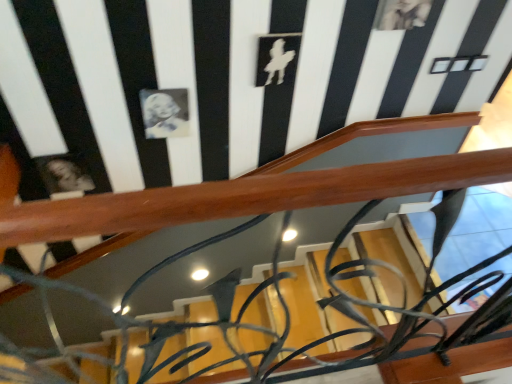
Question: Is matte black portrait at upper left, which is the second art from right to left, taller or shorter than black glossy portrait at upper center, which is the 2th art in bottom-to-top order?

Choices:
 (A) tall
 (B) short

Answer: (B)

Question: In the image, is matte black portrait at upper left, which is the first art from left to right, on the left side or the right side of black glossy portrait at upper center, which is counted as the second art, starting from the left?

Choices:
 (A) left
 (B) right

Answer: (A)

Question: From a real-world perspective, is matte black portrait at upper left, which is the first art from left to right, physically located above or below black glossy portrait at upper center, the 1th art from the top?

Choices:
 (A) below
 (B) above

Answer: (A)

Question: Relative to matte black portrait at upper left, which is the first art from left to right, is black glossy portrait at upper center, the first art in the right-to-left sequence, in front or behind?

Choices:
 (A) front
 (B) behind

Answer: (A)

Question: Is black glossy portrait at upper center, the 1th art from the top, wider or thinner than matte black portrait at upper left, which is the second art from right to left?

Choices:
 (A) wide
 (B) thin

Answer: (A)

Question: From the image's perspective, relative to matte black portrait at upper left, the second art positioned from the top, is black glossy portrait at upper center, the 1th art from the top, above or below?

Choices:
 (A) below
 (B) above

Answer: (B)

Question: Does point (178, 122) appear closer or farther from the camera than point (58, 167)?

Choices:
 (A) closer
 (B) farther

Answer: (A)